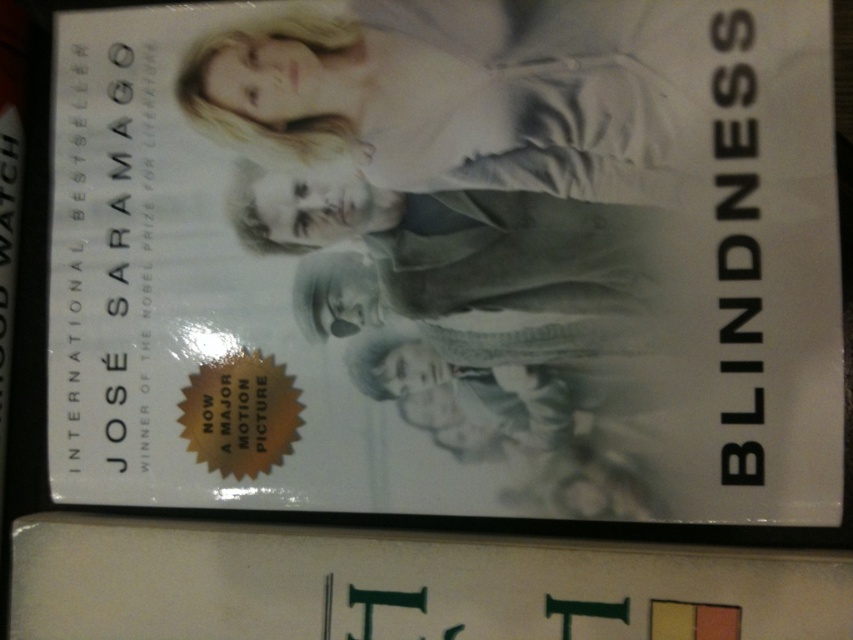
Who is more distant from viewer, [369,92] or [397,273]?

The point [369,92] is behind.

Does point (555, 52) come in front of point (463, 256)?

Yes.

Which is behind, point (402, 20) or point (544, 284)?

Positioned behind is point (402, 20).

Image resolution: width=853 pixels, height=640 pixels. Identify the location of light beige fabric at upper center. (451, 97).